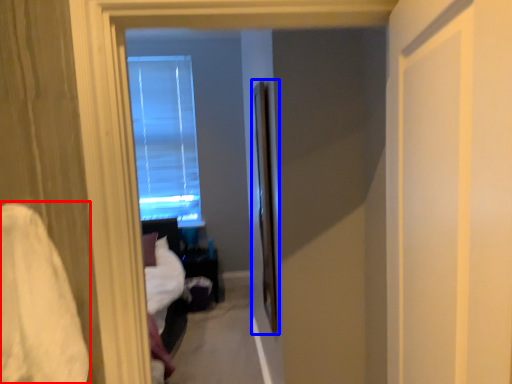
Question: Which point is further to the camera, sheet (highlighted by a red box) or screen door (highlighted by a blue box)?

Choices:
 (A) sheet
 (B) screen door

Answer: (B)